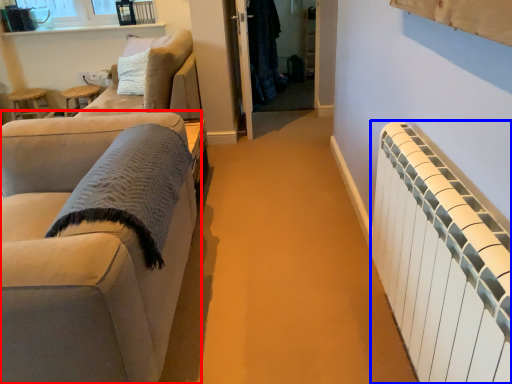
Question: Which point is further to the camera, studio couch (highlighted by a red box) or radiator (highlighted by a blue box)?

Choices:
 (A) studio couch
 (B) radiator

Answer: (A)